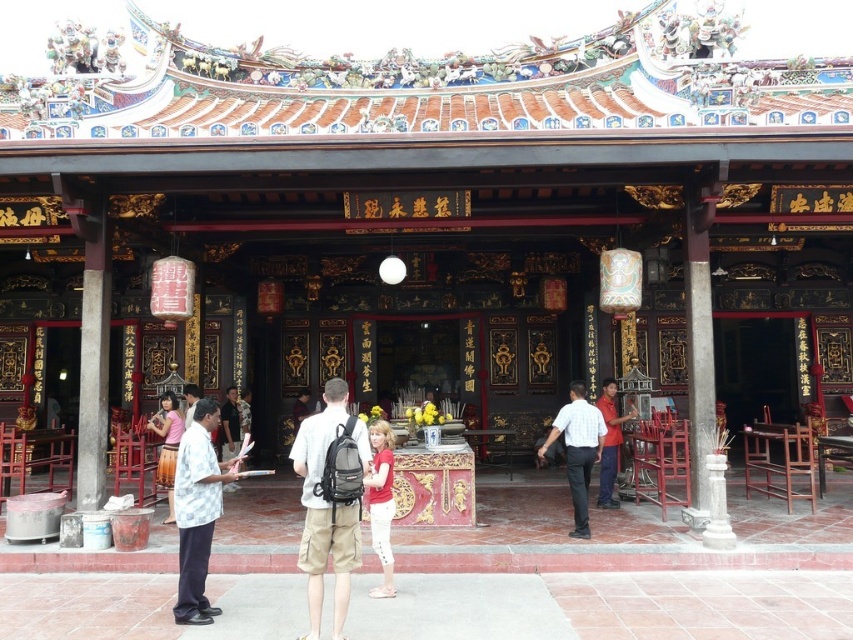
Is red shirt at center thinner than light brown leather jacket at center?

In fact, red shirt at center might be wider than light brown leather jacket at center.

Looking at this image, can you confirm if red shirt at center is smaller than light brown leather jacket at center?

Incorrect, red shirt at center is not smaller in size than light brown leather jacket at center.

Who is more forward, [621,420] or [224,444]?

Positioned in front is point [621,420].

Where is `red shirt at center`? The height and width of the screenshot is (640, 853). red shirt at center is located at coordinates (608, 442).

Based on the photo, between red shirt at center and pink fabric shirt at lower left, which one is positioned higher?

red shirt at center is higher up.

Consider the image. Can you confirm if red shirt at center is wider than pink fabric shirt at lower left?

No.

This screenshot has width=853, height=640. Describe the element at coordinates (608, 442) in the screenshot. I see `red shirt at center` at that location.

The image size is (853, 640). I want to click on red shirt at center, so click(608, 442).

Between point (209, 429) and point (583, 410), which one is positioned in front?

Point (209, 429)

Does white shirt at center lie in front of white cotton shirt at center?

Yes, it is in front of white cotton shirt at center.

Which is in front, point (183, 588) or point (595, 435)?

Point (183, 588) is in front.

At what (x,y) coordinates should I click in order to perform the action: click on white shirt at center. Please return your answer as a coordinate pair (x, y). This screenshot has width=853, height=640. Looking at the image, I should click on (196, 509).